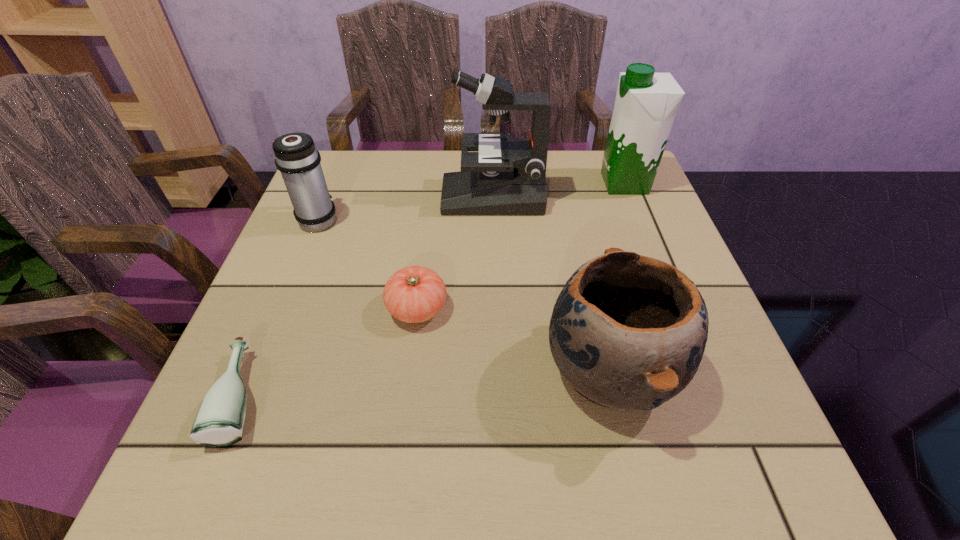
I want to click on free space between the pottery and the shortest object, so click(x=427, y=383).

Where is `free space between the second shortest object and the pottery`? free space between the second shortest object and the pottery is located at coordinates (514, 340).

Find the location of a particular element. The image size is (960, 540). empty space that is in between the second shortest object and the thermos bottle is located at coordinates (x=368, y=264).

Identify which object is the closest to the soya milk. Please provide its 2D coordinates. Your answer should be formatted as a tuple, i.e. [(x, y)], where the tuple contains the x and y coordinates of a point satisfying the conditions above.

[(507, 176)]

Choose which object is the third nearest neighbor to the microscope. Please provide its 2D coordinates. Your answer should be formatted as a tuple, i.e. [(x, y)], where the tuple contains the x and y coordinates of a point satisfying the conditions above.

[(296, 157)]

Identify the location of free space that satisfies the following two spatial constraints: 1. on the front-facing side of the soya milk; 2. on the front side of the pottery. The image size is (960, 540). tap(699, 371).

At what (x,y) coordinates should I click in order to perform the action: click on free space that satisfies the following two spatial constraints: 1. on the back side of the bottle; 2. on the right side of the pottery. Please return your answer as a coordinate pair (x, y). Looking at the image, I should click on pyautogui.click(x=254, y=371).